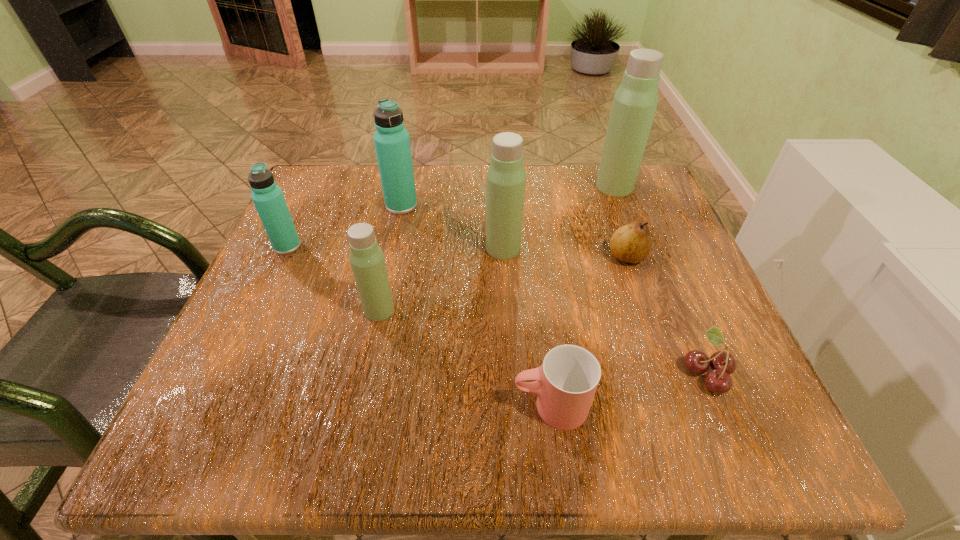
Where is `object that is the fourth closest one to the bigger aqua thermos bottle`? object that is the fourth closest one to the bigger aqua thermos bottle is located at coordinates (631, 243).

Choose which thermos bottle is the third nearest neighbor to the nearer aqua thermos bottle. Please provide its 2D coordinates. Your answer should be formatted as a tuple, i.e. [(x, y)], where the tuple contains the x and y coordinates of a point satisfying the conditions above.

[(506, 178)]

Identify which thermos bottle is the fourth closest to the farther aqua thermos bottle. Please provide its 2D coordinates. Your answer should be formatted as a tuple, i.e. [(x, y)], where the tuple contains the x and y coordinates of a point satisfying the conditions above.

[(634, 105)]

What are the coordinates of `light thermos bottle identified as the closest to the pear` in the screenshot? It's located at tap(634, 105).

Identify which light thermos bottle is the third nearest to the pear. Please provide its 2D coordinates. Your answer should be formatted as a tuple, i.e. [(x, y)], where the tuple contains the x and y coordinates of a point satisfying the conditions above.

[(366, 258)]

The image size is (960, 540). What are the coordinates of `free spot that satisfies the following two spatial constraints: 1. on the back side of the leftmost thermos bottle; 2. on the left side of the tallest object` in the screenshot? It's located at (315, 186).